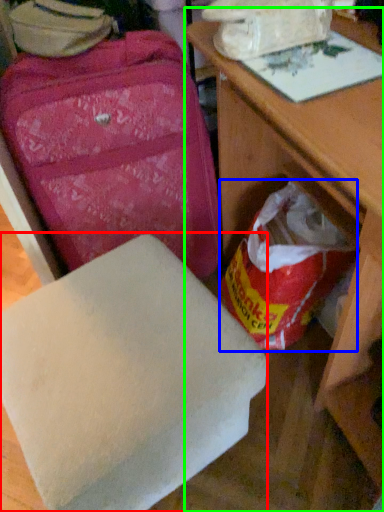
Question: Based on their relative distances, which object is nearer to furniture (highlighted by a red box)? Choose from grocery bag (highlighted by a blue box) and table (highlighted by a green box).

Choices:
 (A) grocery bag
 (B) table

Answer: (B)